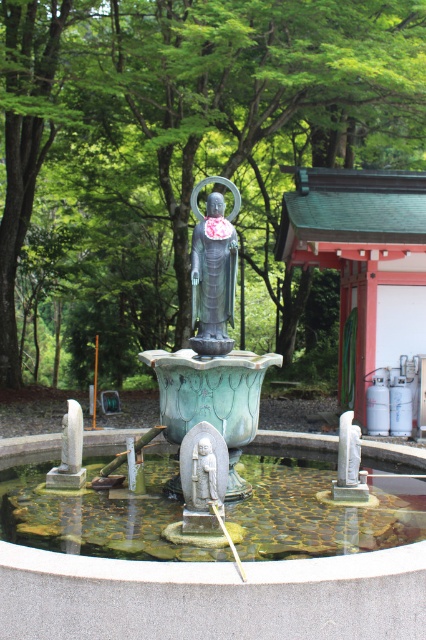
Who is positioned more to the right, green leafy tree at upper center or polished bronze statue at center?

green leafy tree at upper center is more to the right.

Is point (137, 342) positioned in front of point (233, 196)?

No, it is not.

Identify the location of green leafy tree at upper center. The width and height of the screenshot is (426, 640). (178, 156).

Is clear stone water at center further to the viewer compared to polished bronze statue at center?

No, it is not.

Does clear stone water at center appear on the right side of polished bronze statue at center?

Correct, you'll find clear stone water at center to the right of polished bronze statue at center.

The width and height of the screenshot is (426, 640). Identify the location of clear stone water at center. (316, 509).

Does green leafy tree at upper center have a smaller size compared to green patina stone fountain at center?

Actually, green leafy tree at upper center might be larger than green patina stone fountain at center.

Is green leafy tree at upper center closer to the viewer compared to green patina stone fountain at center?

Yes.

Identify the location of green leafy tree at upper center. (178, 156).